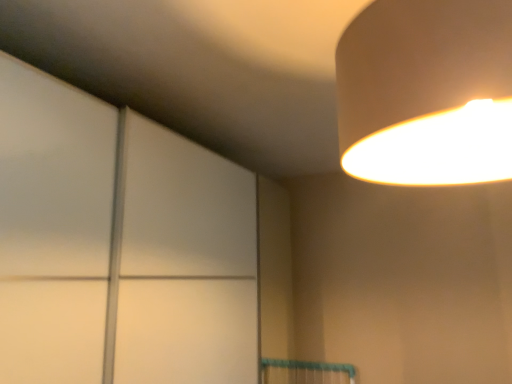
Question: Is matte white lampshade at upper right located outside transparent glass door at upper left?

Choices:
 (A) no
 (B) yes

Answer: (B)

Question: Can you confirm if matte white lampshade at upper right is taller than transparent glass door at upper left?

Choices:
 (A) no
 (B) yes

Answer: (A)

Question: Is matte white lampshade at upper right to the right of transparent glass door at upper left from the viewer's perspective?

Choices:
 (A) yes
 (B) no

Answer: (A)

Question: Does matte white lampshade at upper right contain transparent glass door at upper left?

Choices:
 (A) yes
 (B) no

Answer: (B)

Question: Could you tell me if matte white lampshade at upper right is turned towards transparent glass door at upper left?

Choices:
 (A) yes
 (B) no

Answer: (A)

Question: Does matte white lampshade at upper right lie behind transparent glass door at upper left?

Choices:
 (A) yes
 (B) no

Answer: (B)

Question: Is transparent glass door at upper left facing towards matte white lampshade at upper right?

Choices:
 (A) yes
 (B) no

Answer: (A)

Question: Considering the relative sizes of transparent glass door at upper left and matte white lampshade at upper right in the image provided, is transparent glass door at upper left thinner than matte white lampshade at upper right?

Choices:
 (A) no
 (B) yes

Answer: (A)

Question: From the image's perspective, would you say transparent glass door at upper left is positioned over matte white lampshade at upper right?

Choices:
 (A) no
 (B) yes

Answer: (A)

Question: Considering the relative sizes of transparent glass door at upper left and matte white lampshade at upper right in the image provided, is transparent glass door at upper left bigger than matte white lampshade at upper right?

Choices:
 (A) no
 (B) yes

Answer: (B)

Question: Can you confirm if transparent glass door at upper left is smaller than matte white lampshade at upper right?

Choices:
 (A) yes
 (B) no

Answer: (B)

Question: Is transparent glass door at upper left oriented away from matte white lampshade at upper right?

Choices:
 (A) no
 (B) yes

Answer: (A)

Question: Based on their positions, is matte white lampshade at upper right located to the left or right of transparent glass door at upper left?

Choices:
 (A) left
 (B) right

Answer: (B)